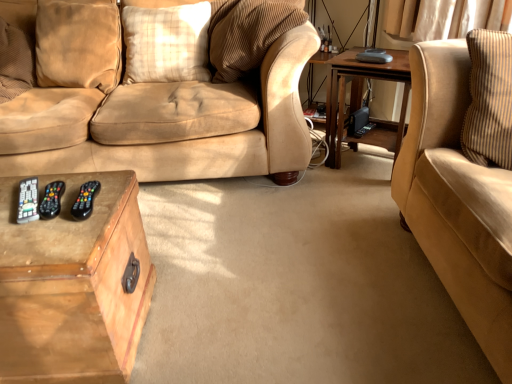
Question: Is wooden table at right, the 1th table positioned from the right, positioned with its back to velvet beige pillow at upper left, acting as the 2th pillow starting from the right?

Choices:
 (A) yes
 (B) no

Answer: (B)

Question: Is velvet beige pillow at upper left, arranged as the 1th pillow when viewed from the left, inside wooden table at right, the second table positioned from the left?

Choices:
 (A) yes
 (B) no

Answer: (B)

Question: Does wooden table at right, the second table viewed from the front, have a lesser height compared to velvet beige pillow at upper left, arranged as the 1th pillow when viewed from the left?

Choices:
 (A) yes
 (B) no

Answer: (B)

Question: Would you say wooden table at right, the 1th table viewed from the back, is a long distance from velvet beige pillow at upper left, acting as the 2th pillow starting from the right?

Choices:
 (A) yes
 (B) no

Answer: (A)

Question: From a real-world perspective, is wooden table at right, the second table positioned from the left, below velvet beige pillow at upper left, arranged as the 1th pillow when viewed from the left?

Choices:
 (A) yes
 (B) no

Answer: (A)

Question: Does wooden table at right, the second table viewed from the front, have a smaller size compared to velvet beige pillow at upper left, acting as the 2th pillow starting from the right?

Choices:
 (A) no
 (B) yes

Answer: (A)

Question: Is velvet beige pillow at upper left, arranged as the 1th pillow when viewed from the left, surrounded by plaid fabric pillow at center, the second pillow positioned from the left?

Choices:
 (A) yes
 (B) no

Answer: (B)

Question: Is plaid fabric pillow at center, which is counted as the 1th pillow, starting from the right, taller than velvet beige pillow at upper left, arranged as the 1th pillow when viewed from the left?

Choices:
 (A) yes
 (B) no

Answer: (B)

Question: Is plaid fabric pillow at center, the second pillow positioned from the left, aimed at velvet beige pillow at upper left, arranged as the 1th pillow when viewed from the left?

Choices:
 (A) yes
 (B) no

Answer: (B)

Question: Considering the relative positions of plaid fabric pillow at center, which is counted as the 1th pillow, starting from the right, and velvet beige pillow at upper left, arranged as the 1th pillow when viewed from the left, in the image provided, is plaid fabric pillow at center, which is counted as the 1th pillow, starting from the right, in front of velvet beige pillow at upper left, arranged as the 1th pillow when viewed from the left,?

Choices:
 (A) no
 (B) yes

Answer: (A)

Question: From a real-world perspective, is plaid fabric pillow at center, which is counted as the 1th pillow, starting from the right, located higher than velvet beige pillow at upper left, acting as the 2th pillow starting from the right?

Choices:
 (A) yes
 (B) no

Answer: (B)

Question: Is plaid fabric pillow at center, the second pillow positioned from the left, in contact with velvet beige pillow at upper left, acting as the 2th pillow starting from the right?

Choices:
 (A) no
 (B) yes

Answer: (A)

Question: Does suede beige couch at right have a greater width compared to wooden table at right, the 1th table positioned from the right?

Choices:
 (A) no
 (B) yes

Answer: (B)